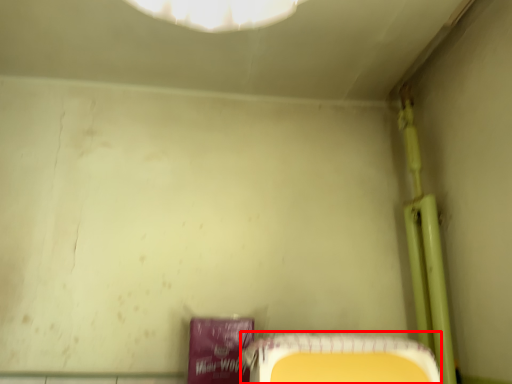
Question: Where is furniture (annotated by the red box) located in relation to pipe in the image?

Choices:
 (A) left
 (B) right

Answer: (A)